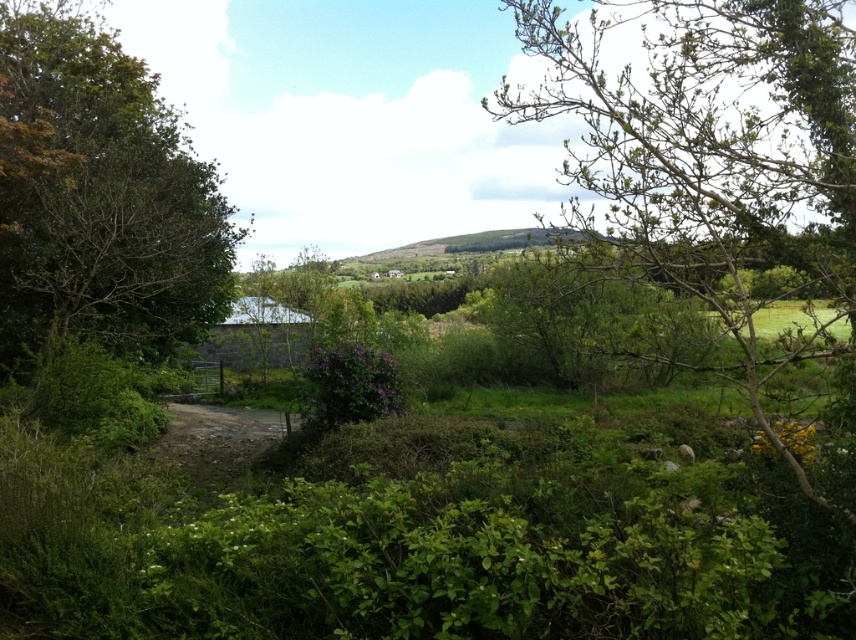
Question: In this image, where is bare branches at upper right located relative to dirt/gravel path at center?

Choices:
 (A) left
 (B) right

Answer: (B)

Question: Is green leafy tree at left above dirt/gravel path at center?

Choices:
 (A) yes
 (B) no

Answer: (A)

Question: Which object appears farthest from the camera in this image?

Choices:
 (A) bare branches at upper right
 (B) dirt/gravel path at center
 (C) green leafy tree at left

Answer: (B)

Question: Estimate the real-world distances between objects in this image. Which object is closer to the green leafy tree at left?

Choices:
 (A) dirt/gravel path at center
 (B) bare branches at upper right

Answer: (A)

Question: In this image, where is bare branches at upper right located relative to green leafy tree at left?

Choices:
 (A) left
 (B) right

Answer: (B)

Question: Which point is closer to the camera?

Choices:
 (A) (795, 122)
 (B) (110, 83)

Answer: (A)